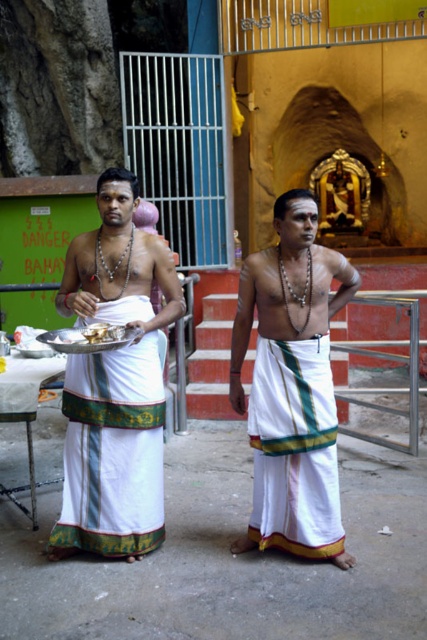
Question: Can you confirm if white clothed man at left is positioned to the right of white cotton dhoti at center?

Choices:
 (A) yes
 (B) no

Answer: (B)

Question: Is white clothed man at center wider than golden metallic plate at center?

Choices:
 (A) no
 (B) yes

Answer: (B)

Question: Based on their relative distances, which object is nearer to the white cotton dhoti at center?

Choices:
 (A) white clothed man at center
 (B) golden metallic plate at center
 (C) white clothed man at left

Answer: (A)

Question: Which is farther from the white cotton dhoti at center?

Choices:
 (A) golden metallic plate at center
 (B) white clothed man at left
 (C) white clothed man at center

Answer: (A)

Question: Which of these objects is positioned closest to the white cotton dhoti at center?

Choices:
 (A) golden metallic plate at center
 (B) white clothed man at center

Answer: (B)

Question: Observing the image, what is the correct spatial positioning of white clothed man at center in reference to golden metallic plate at center?

Choices:
 (A) right
 (B) left

Answer: (A)